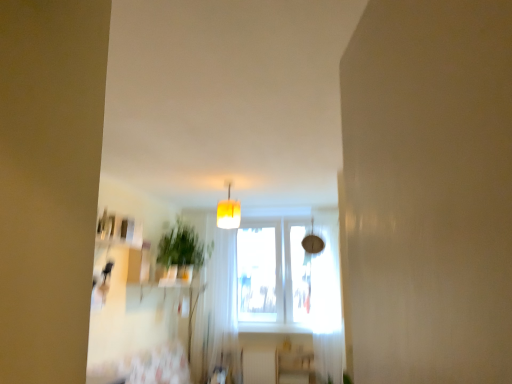
Question: From a real-world perspective, is yellow fabric lampshade at center positioned above or below green leafy plant at center?

Choices:
 (A) above
 (B) below

Answer: (A)

Question: In terms of width, does yellow fabric lampshade at center look wider or thinner when compared to green leafy plant at center?

Choices:
 (A) wide
 (B) thin

Answer: (B)

Question: Which is farther from the yellow fabric lampshade at center?

Choices:
 (A) green leafy plant at center
 (B) white sheer curtain at right, which appears as the 1th curtain when viewed from the right
 (C) wooden shelf at lower center
 (D) white sheer curtain at center, which appears as the 2th curtain when viewed from the right

Answer: (C)

Question: Estimate the real-world distances between objects in this image. Which object is closer to the white sheer curtain at right, which appears as the 2th curtain when viewed from the left?

Choices:
 (A) yellow fabric lampshade at center
 (B) white sheer curtain at center, which appears as the 2th curtain when viewed from the right
 (C) wooden shelf at lower center
 (D) green leafy plant at center

Answer: (C)